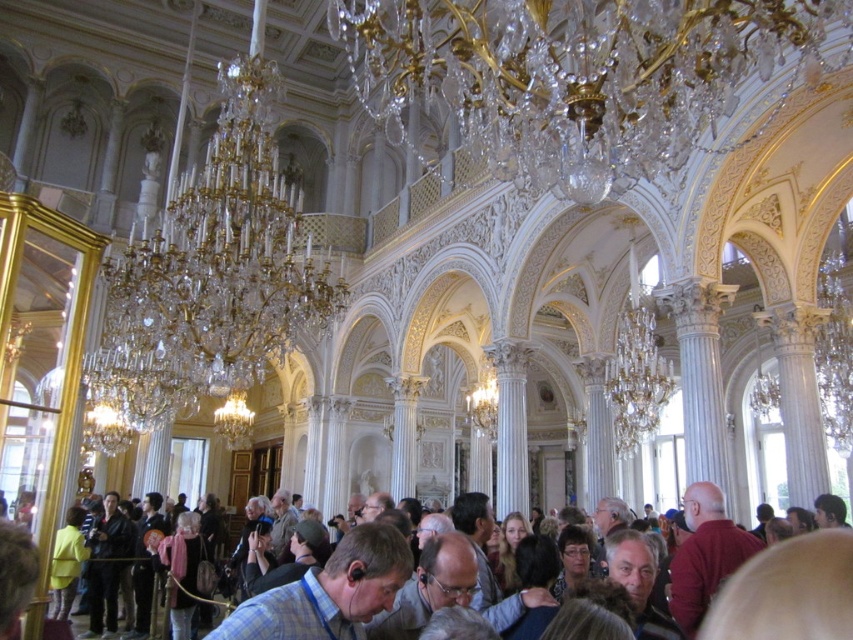
Question: Is crystal/golden chandelier at upper center closer to the viewer compared to dark brown leather jacket at center?

Choices:
 (A) no
 (B) yes

Answer: (A)

Question: Does crystal/golden chandelier at upper center have a smaller size compared to blue plaid shirt at center?

Choices:
 (A) yes
 (B) no

Answer: (B)

Question: Among these points, which one is farthest from the camera?

Choices:
 (A) (235, 620)
 (B) (257, 284)

Answer: (B)

Question: Does crystal/glass chandelier at upper center appear on the left side of blue plaid shirt at center?

Choices:
 (A) no
 (B) yes

Answer: (A)

Question: Which point is farther from the camera taking this photo?

Choices:
 (A) (328, 593)
 (B) (223, 211)
 (C) (779, 604)

Answer: (B)

Question: Estimate the real-world distances between objects in this image. Which object is farther from the crystal/glass chandelier at upper center?

Choices:
 (A) dark brown leather jacket at center
 (B) blue plaid shirt at center

Answer: (B)